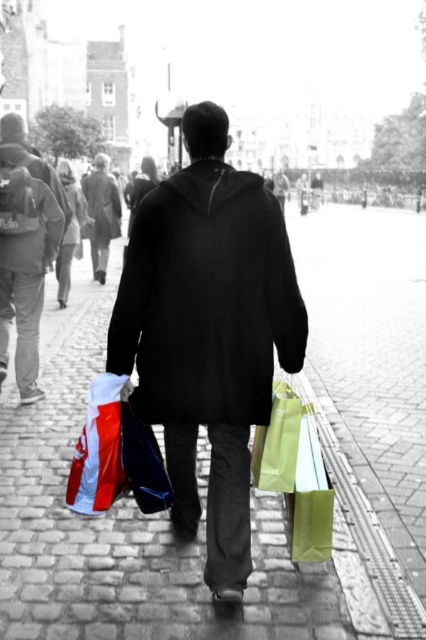
Is black matte coat at center wider than matte black hoodie at upper left?

Indeed, black matte coat at center has a greater width compared to matte black hoodie at upper left.

Is black matte coat at center in front of matte black hoodie at upper left?

Yes.

Which is in front, point (252, 204) or point (28, 284)?

Positioned in front is point (252, 204).

At what (x,y) coordinates should I click in order to perform the action: click on black matte coat at center. Please return your answer as a coordinate pair (x, y). Looking at the image, I should click on (209, 332).

Who is shorter, cobblestone pavement at center or matte black hoodie at upper left?

matte black hoodie at upper left is shorter.

Which is behind, point (345, 586) or point (29, 257)?

The point (29, 257) is more distant.

Locate an element on the screen. cobblestone pavement at center is located at coordinates coord(252,492).

Does cobblestone pavement at center come in front of matte green paper bag at lower right?

Yes, it is.

Between cobblestone pavement at center and matte green paper bag at lower right, which one has less height?

matte green paper bag at lower right is shorter.

In order to click on cobblestone pavement at center in this screenshot , I will do `click(252, 492)`.